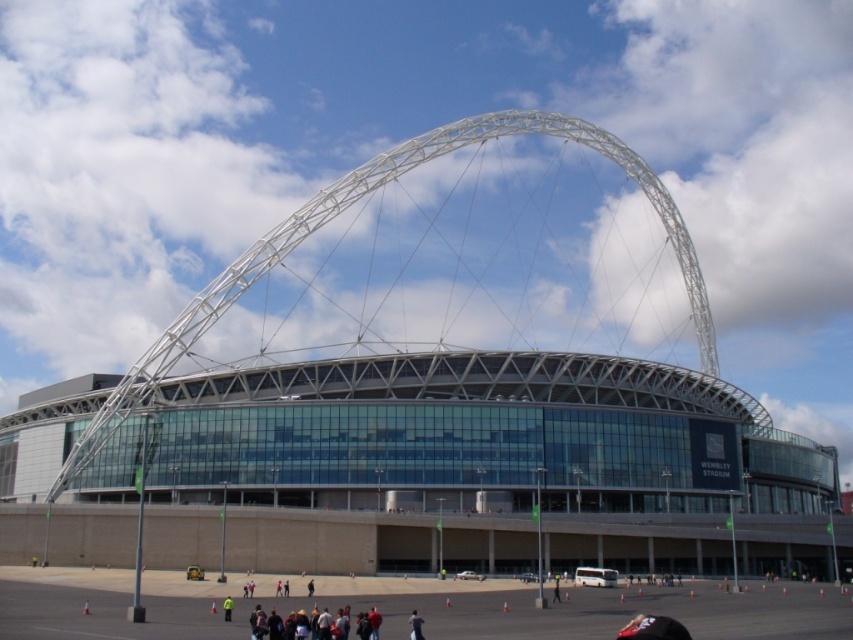
Who is more forward, [318,632] or [419,625]?

Positioned in front is point [318,632].

Between dark gray fabric group at lower center and dark brown leather jacket at lower center, which one is positioned higher?

dark gray fabric group at lower center

Between point (345, 636) and point (409, 621), which one is positioned in front?

Point (345, 636) is more forward.

At what (x,y) coordinates should I click in order to perform the action: click on dark gray fabric group at lower center. Please return your answer as a coordinate pair (x, y). Image resolution: width=853 pixels, height=640 pixels. Looking at the image, I should click on (309, 625).